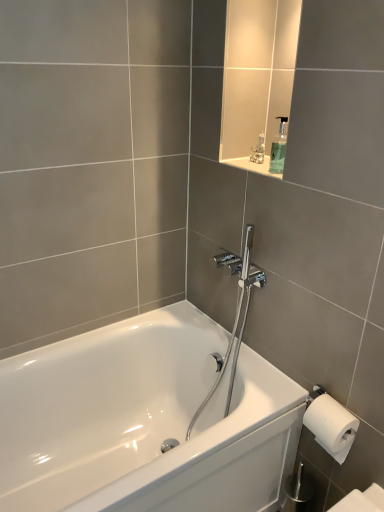
Question: Is polished chrome shower head at center in front of or behind metallic silver figurine at upper center in the image?

Choices:
 (A) front
 (B) behind

Answer: (A)

Question: Is polished chrome shower head at center inside the boundaries of metallic silver figurine at upper center, or outside?

Choices:
 (A) outside
 (B) inside

Answer: (A)

Question: Based on their relative distances, which object is farther from the metallic silver figurine at upper center?

Choices:
 (A) polished chrome shower head at center
 (B) white glossy bathtub at center
 (C) transparent plastic soap dispenser at upper center

Answer: (B)

Question: Which object is positioned closest to the white glossy bathtub at center?

Choices:
 (A) metallic silver figurine at upper center
 (B) transparent plastic soap dispenser at upper center
 (C) polished chrome shower head at center

Answer: (C)